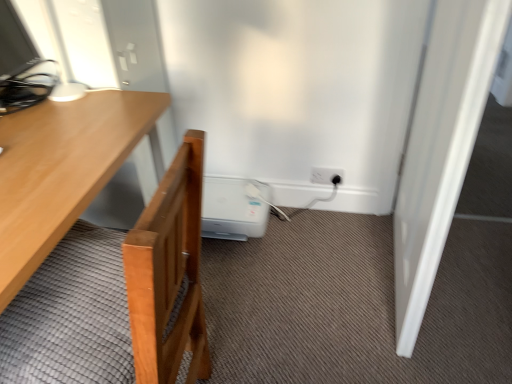
Locate an element on the screen. The image size is (512, 384). free space above wooden desk at left (from a real-world perspective) is located at coordinates coord(48,145).